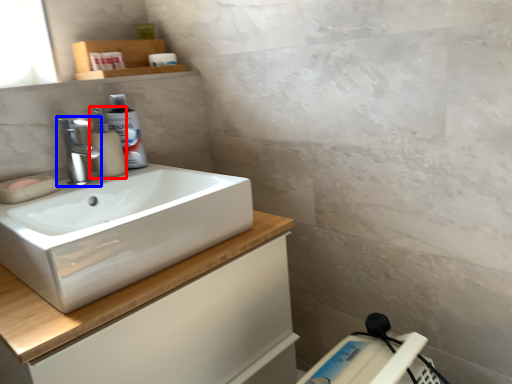
Question: Which object is closer to the camera taking this photo, soap dispenser (highlighted by a red box) or tap (highlighted by a blue box)?

Choices:
 (A) soap dispenser
 (B) tap

Answer: (B)